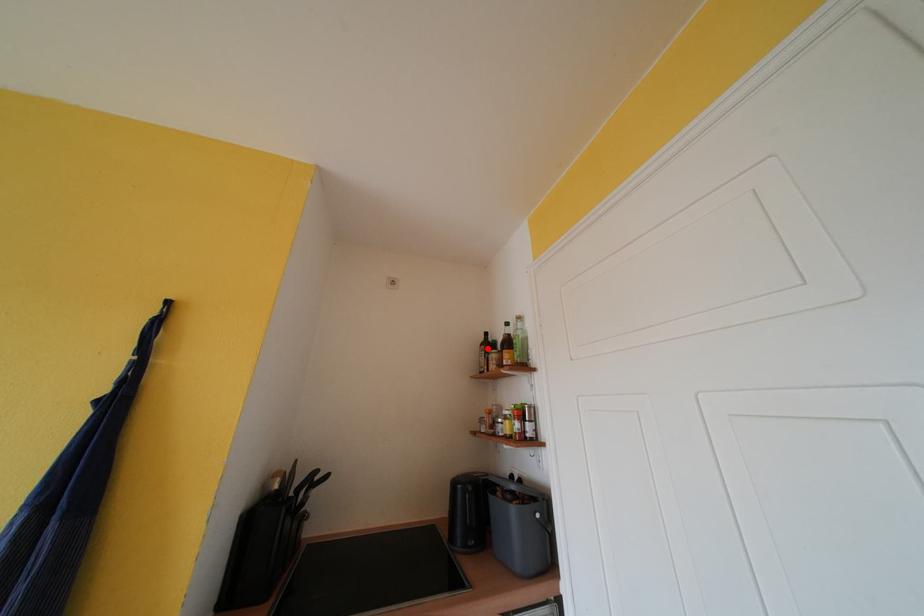
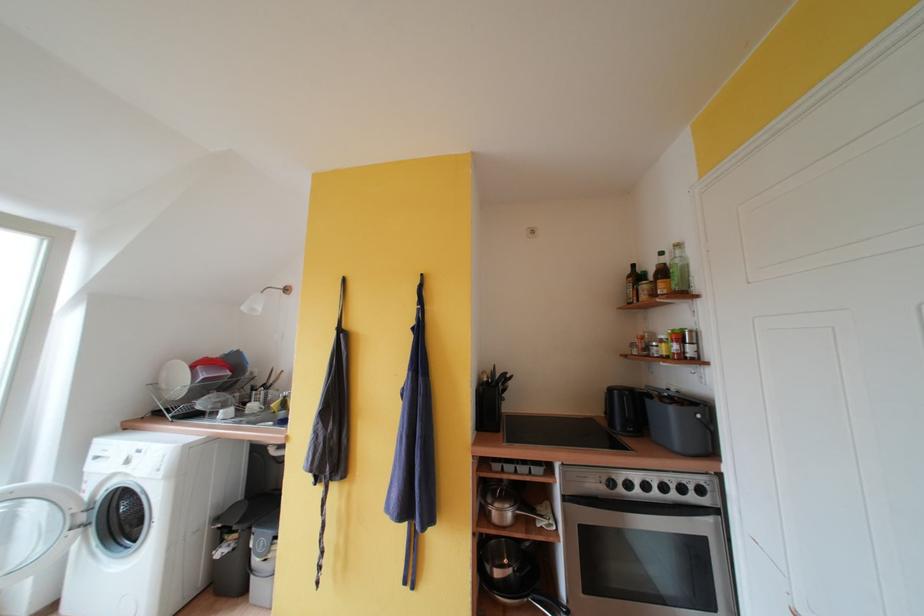
Question: I am providing you with two images of the same scene from different viewpoints. A red point is marked on the first image. Can you still see the location of the red point in image 2?

Choices:
 (A) Yes
 (B) No

Answer: (A)